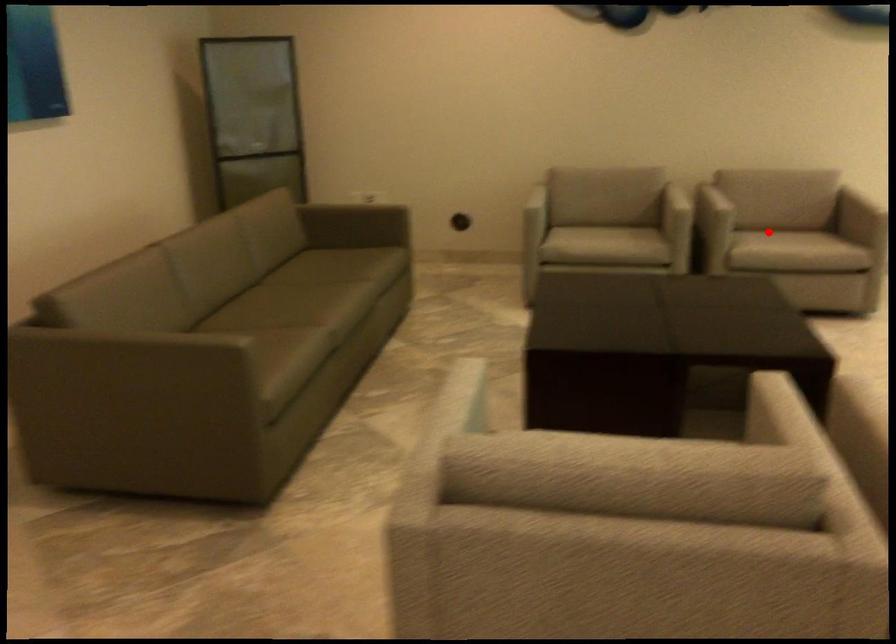
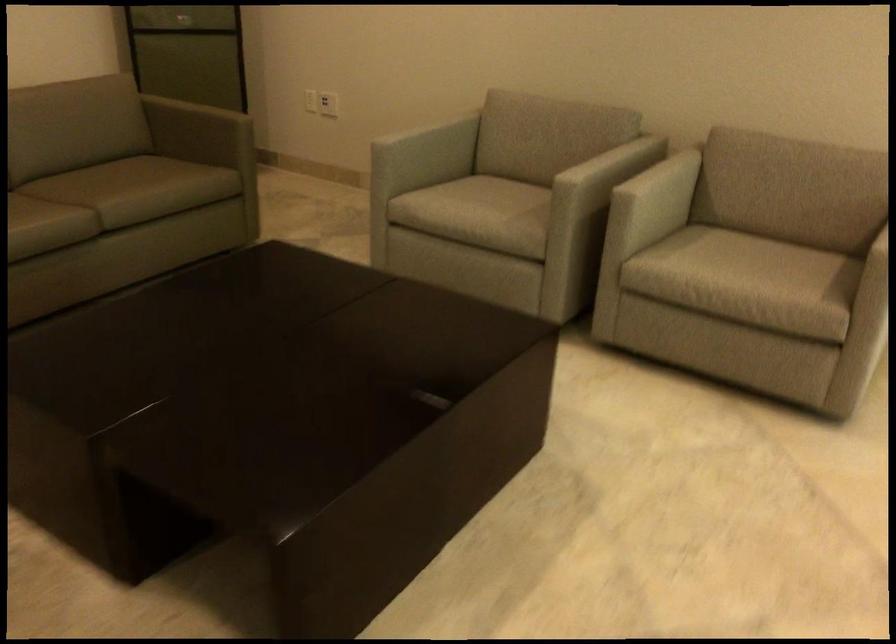
Question: I am providing you with two images of the same scene from different viewpoints. In image1, a red point is highlighted. Considering the same 3D point in image2, which of the following is correct?

Choices:
 (A) It is closer
 (B) It is farther

Answer: (A)